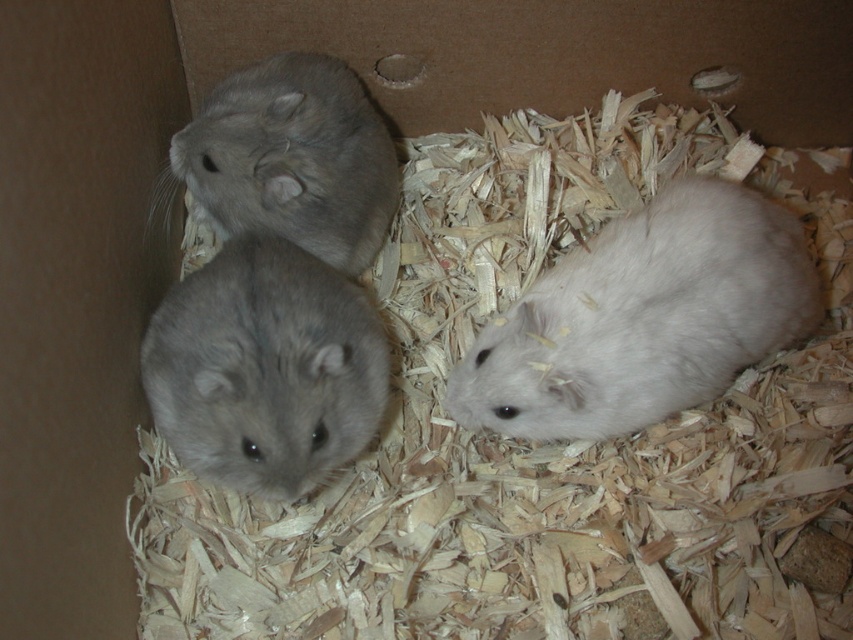
Measure the distance between white fluffy hamster at right and gray soft fur hamster at upper left.

A distance of 15.41 inches exists between white fluffy hamster at right and gray soft fur hamster at upper left.

Which of these two, white fluffy hamster at right or gray soft fur hamster at upper left, stands taller?

white fluffy hamster at right

Is point (625, 342) closer to camera compared to point (228, 225)?

Yes.

Find the location of a particular element. The width and height of the screenshot is (853, 640). white fluffy hamster at right is located at coordinates (643, 317).

Can you confirm if gray soft fur hamster at center is positioned above gray soft fur hamster at upper left?

No.

Can you confirm if gray soft fur hamster at center is thinner than gray soft fur hamster at upper left?

Yes, gray soft fur hamster at center is thinner than gray soft fur hamster at upper left.

This screenshot has width=853, height=640. What do you see at coordinates (265, 369) in the screenshot?
I see `gray soft fur hamster at center` at bounding box center [265, 369].

Identify the location of gray soft fur hamster at center. (265, 369).

Can you confirm if white fluffy hamster at right is smaller than gray soft fur hamster at center?

Incorrect, white fluffy hamster at right is not smaller in size than gray soft fur hamster at center.

Is white fluffy hamster at right to the right of gray soft fur hamster at center from the viewer's perspective?

Correct, you'll find white fluffy hamster at right to the right of gray soft fur hamster at center.

Which is in front, point (576, 397) or point (149, 360)?

Point (576, 397)

This screenshot has height=640, width=853. What are the coordinates of `white fluffy hamster at right` in the screenshot? It's located at (643, 317).